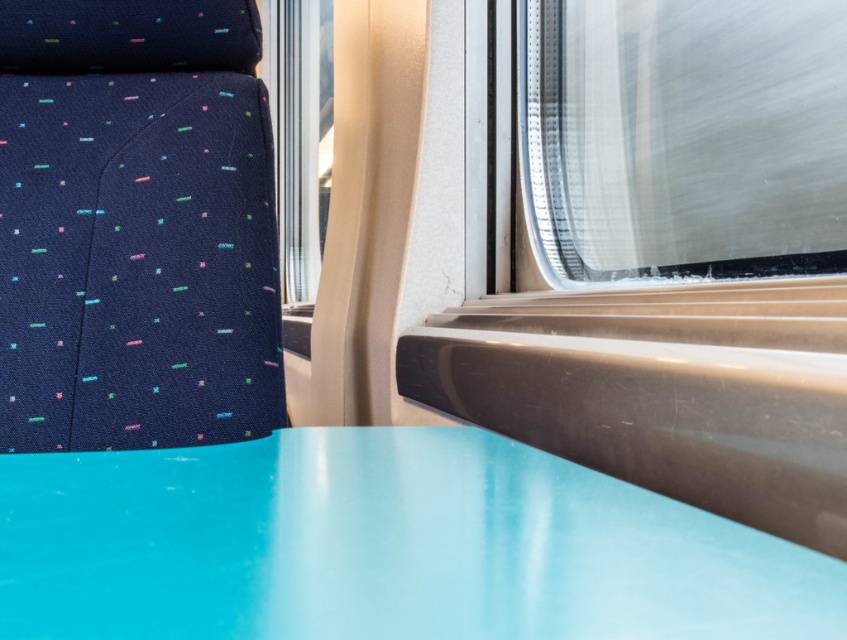
Which of these two, glossy plastic table at center or transparent glass train window at upper right, stands shorter?

Standing shorter between the two is glossy plastic table at center.

In the scene shown: How distant is glossy plastic table at center from transparent glass train window at upper right?

27.83 inches

What are the coordinates of `glossy plastic table at center` in the screenshot? It's located at (383, 547).